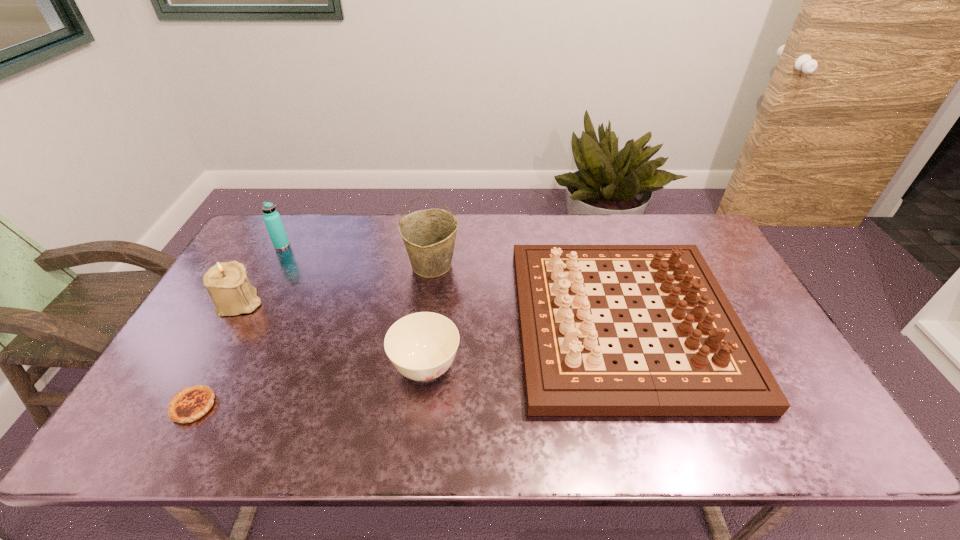
Find the location of a particular element. This screenshot has height=540, width=960. free spot located on the side with the white pieces of the third shortest object is located at coordinates (497, 322).

At what (x,y) coordinates should I click in order to perform the action: click on blank area located on the side with the white pieces of the third shortest object. Please return your answer as a coordinate pair (x, y). The image size is (960, 540). Looking at the image, I should click on (437, 322).

Where is `free space located 0.380m on the side with the white pieces of the third shortest object`? Image resolution: width=960 pixels, height=540 pixels. free space located 0.380m on the side with the white pieces of the third shortest object is located at coordinates (384, 322).

This screenshot has width=960, height=540. In order to click on blank area located 0.190m on the right of the sugar bowl in this screenshot , I will do `click(536, 368)`.

Locate an element on the screen. The width and height of the screenshot is (960, 540). blank space located 0.390m on the right of the shortest object is located at coordinates (379, 406).

You are a GUI agent. You are given a task and a screenshot of the screen. Output one action in this format:
    pyautogui.click(x=<x>, y=<y>)
    Task: Click on the wine bucket positioned at the far edge
    
    Given the screenshot: What is the action you would take?
    pyautogui.click(x=429, y=236)

The height and width of the screenshot is (540, 960). What are the coordinates of `water bottle that is at the far edge` in the screenshot? It's located at point(273,222).

The image size is (960, 540). Identify the location of gameboard located in the far edge section of the desktop. (568, 367).

Find the location of a particular element. gameboard that is at the near edge is located at coordinates (568, 367).

Image resolution: width=960 pixels, height=540 pixels. I want to click on quiche situated at the near edge, so click(189, 404).